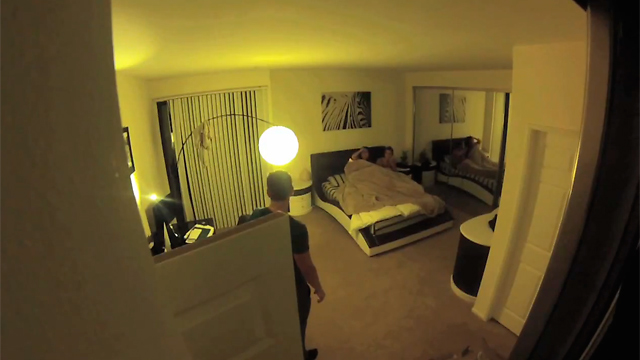
Find the location of a particular element. Image resolution: width=640 pixels, height=360 pixels. blinds is located at coordinates (217, 177), (241, 132).